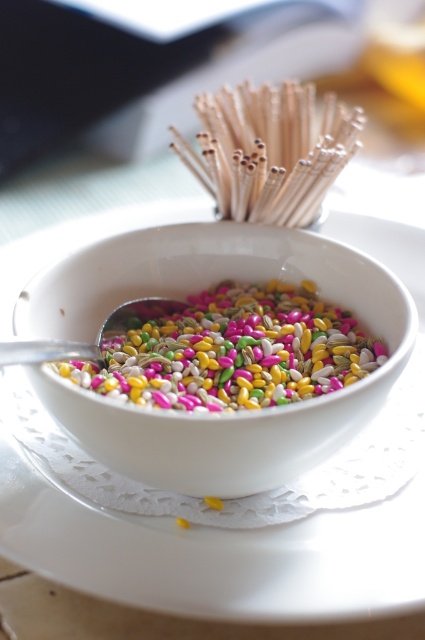
Is white glossy bowl at center further to the viewer compared to multicolored coated seeds at center?

No, white glossy bowl at center is closer to the viewer.

Which is behind, point (410, 337) or point (147, 336)?

Point (147, 336)

What do you see at coordinates (207, 413) in the screenshot?
I see `white glossy bowl at center` at bounding box center [207, 413].

Where is `white glossy bowl at center`? white glossy bowl at center is located at coordinates (207, 413).

Which is below, white glossy bowl at center or wooden chopsticks at upper center?

white glossy bowl at center

The image size is (425, 640). I want to click on white glossy bowl at center, so click(207, 413).

What are the coordinates of `white glossy bowl at center` in the screenshot? It's located at (207, 413).

Does multicolored coated seeds at center lie behind metallic silver spoon at center?

Yes, multicolored coated seeds at center is behind metallic silver spoon at center.

Is point (104, 356) in front of point (104, 326)?

Yes, point (104, 356) is closer to viewer.

Locate an element on the screen. This screenshot has height=640, width=425. multicolored coated seeds at center is located at coordinates (229, 349).